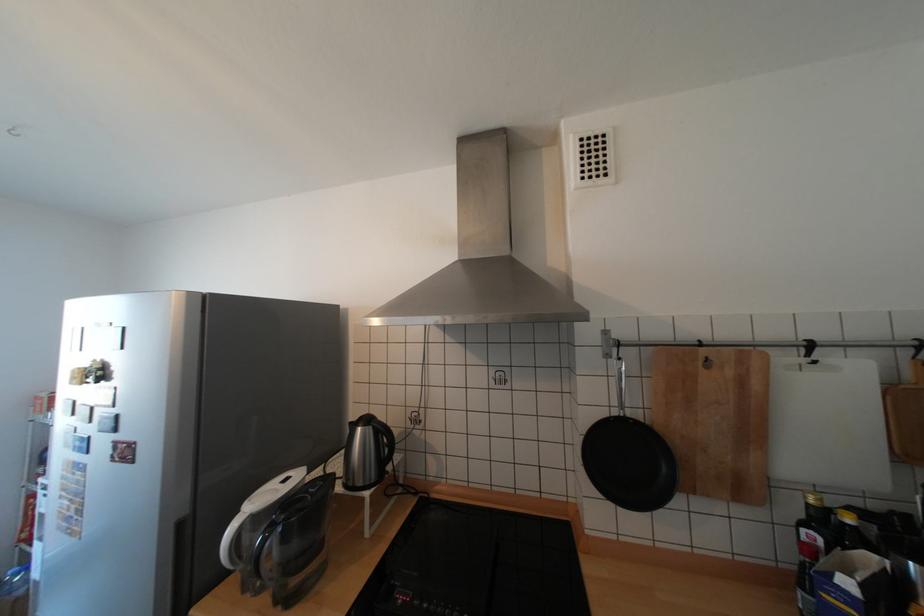
Identify the location of white cutting board. The image size is (924, 616). (828, 424).